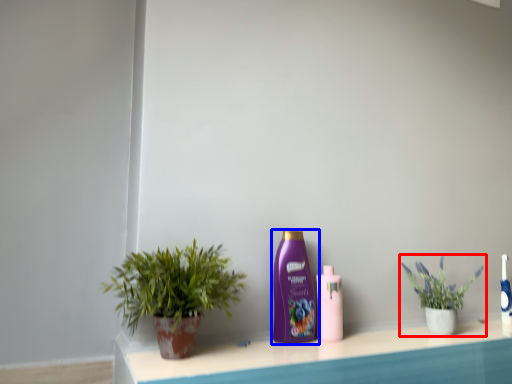
Question: Among these objects, which one is farthest to the camera, houseplant (highlighted by a red box) or bottle (highlighted by a blue box)?

Choices:
 (A) houseplant
 (B) bottle

Answer: (A)